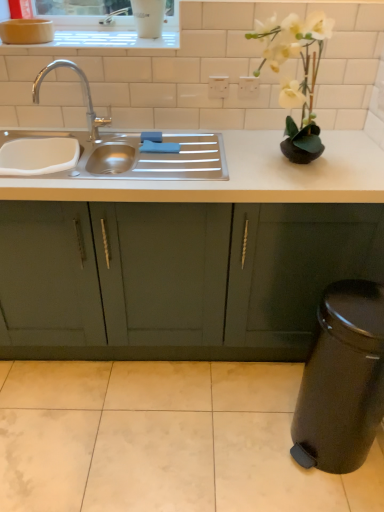
Question: Considering the positions of point (281, 51) and point (57, 38), is point (281, 51) closer or farther from the camera than point (57, 38)?

Choices:
 (A) farther
 (B) closer

Answer: (B)

Question: Considering the positions of white matte vase at upper right and white ceramic window sill at upper center in the image, is white matte vase at upper right taller or shorter than white ceramic window sill at upper center?

Choices:
 (A) tall
 (B) short

Answer: (A)

Question: Which object is positioned closest to the white matte vase at upper right?

Choices:
 (A) stainless steel sink at left
 (B) white ceramic window sill at upper center
 (C) matte green cabinets at center

Answer: (A)

Question: Which object is the closest to the white matte vase at upper right?

Choices:
 (A) matte green cabinets at center
 (B) stainless steel sink at left
 (C) white ceramic window sill at upper center

Answer: (B)